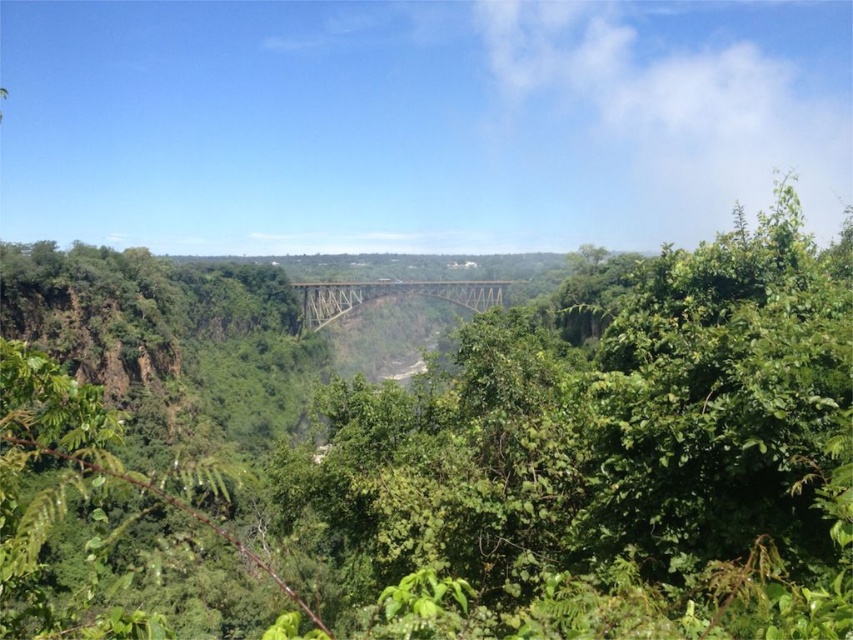
You are a hiker planning to cross the metallic bridge at center. You notice a green leafy tree at center nearby. Which object is bigger in size?

The green leafy tree at center is larger in size compared to the metallic bridge at center according to the description.

You are a hiker standing at the green leafy tree at center. You want to cross the gorge to the other side. The bridge is 33.47 meters away from the tree. If your backpack weighs 15 kilograms, can you safely cross the bridge?

The bridge is 33.47 meters away from the green leafy tree at center. Since the bridge is designed to support the weight of hikers and their gear, and there is no mention of the bridge being damaged or having weight restrictions, you can safely cross the bridge with your 15 kg backpack.

You are standing at the point closer to the camera in the image. Which point are you at, point [692,608] or point [497,301]?

You are at point [692,608] because it is closer to the camera than point [497,301].